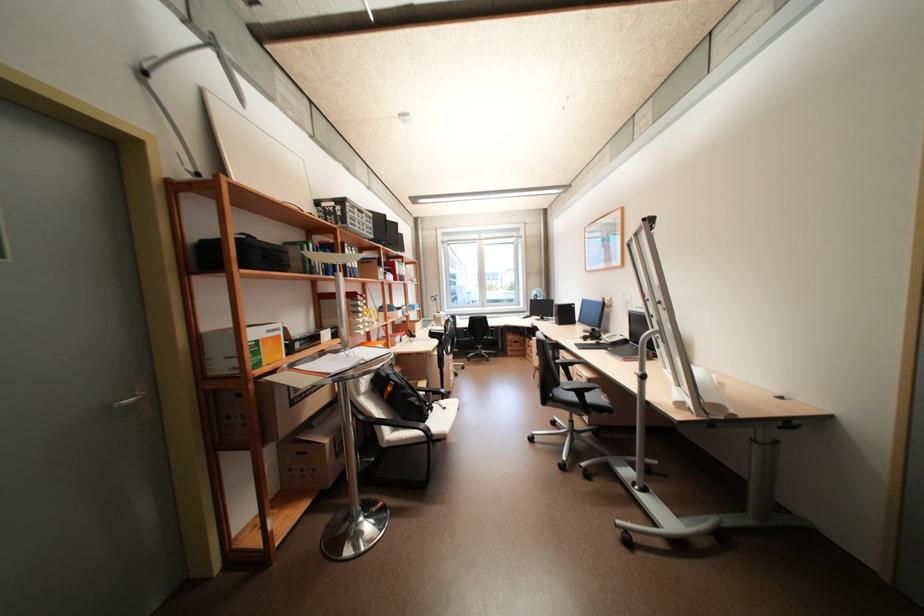
Where would you typ the black computer keyboard? Please return your answer as a coordinate pair (x, y).

(596, 345)